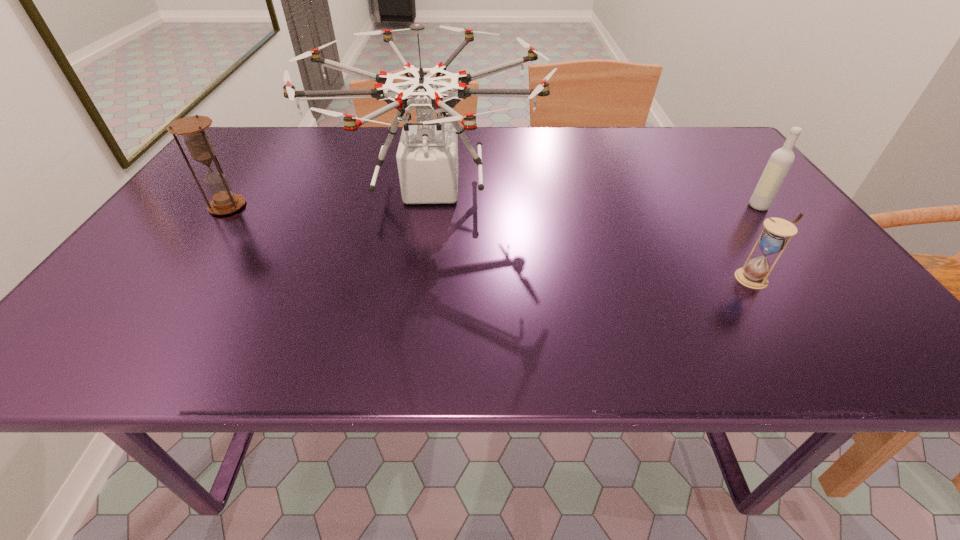
At what (x,y) coordinates should I click in order to perform the action: click on vacant space that satisfies the following two spatial constraints: 1. on the front side of the shortest object; 2. on the right side of the drone. Please return your answer as a coordinate pair (x, y). The image size is (960, 540). Looking at the image, I should click on (419, 278).

The width and height of the screenshot is (960, 540). Find the location of `free location that satisfies the following two spatial constraints: 1. on the front side of the right hourglass; 2. on the left side of the leftmost object`. free location that satisfies the following two spatial constraints: 1. on the front side of the right hourglass; 2. on the left side of the leftmost object is located at coordinates (177, 278).

Locate an element on the screen. This screenshot has height=540, width=960. vacant space that satisfies the following two spatial constraints: 1. on the front side of the nearest object; 2. on the right side of the left hourglass is located at coordinates (177, 278).